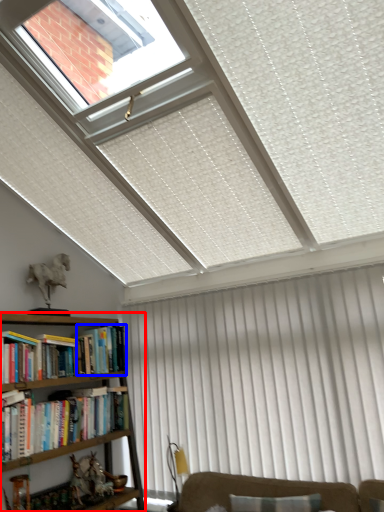
Question: Among these objects, which one is farthest to the camera, bookcase (highlighted by a red box) or book (highlighted by a blue box)?

Choices:
 (A) bookcase
 (B) book

Answer: (B)